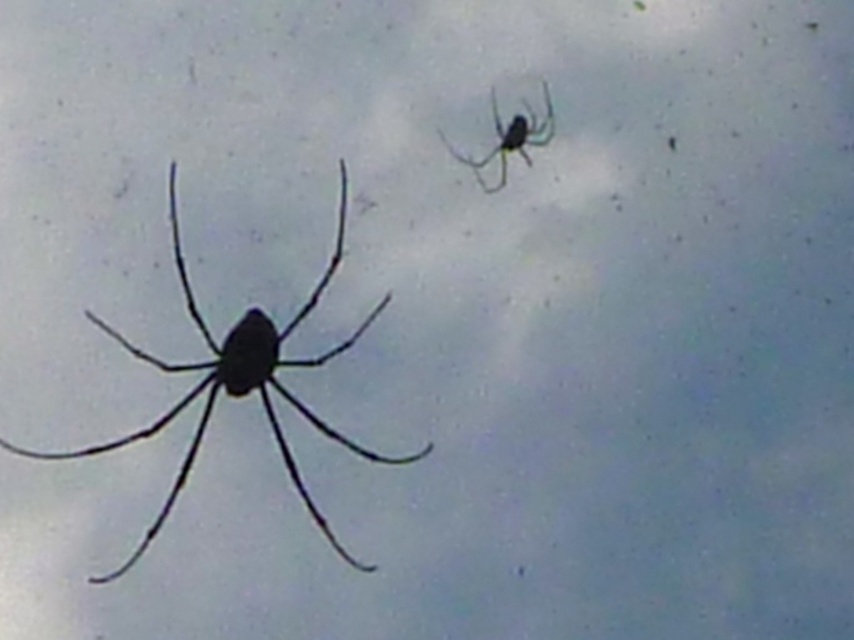
Which is more to the left, black matte spider at left or green glossy spider at upper right?

black matte spider at left is more to the left.

Is black matte spider at left wider than green glossy spider at upper right?

Yes, black matte spider at left is wider than green glossy spider at upper right.

Between point (267, 326) and point (459, 152), which one is positioned in front?

Point (267, 326) is in front.

The image size is (854, 640). I want to click on black matte spider at left, so click(x=237, y=384).